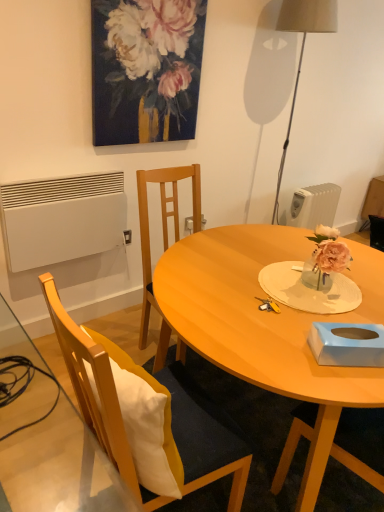
Question: Does wooden chair at left have a smaller size compared to blue cardboard tissue box at lower right?

Choices:
 (A) no
 (B) yes

Answer: (A)

Question: Does wooden chair at left have a larger size compared to blue cardboard tissue box at lower right?

Choices:
 (A) yes
 (B) no

Answer: (A)

Question: Could you tell me if wooden chair at left is turned towards blue cardboard tissue box at lower right?

Choices:
 (A) no
 (B) yes

Answer: (B)

Question: Does wooden chair at left have a greater width compared to blue cardboard tissue box at lower right?

Choices:
 (A) no
 (B) yes

Answer: (B)

Question: Is wooden chair at left positioned with its back to blue cardboard tissue box at lower right?

Choices:
 (A) yes
 (B) no

Answer: (B)

Question: In the image, is wooden chair at left positioned in front of or behind blue cardboard tissue box at lower right?

Choices:
 (A) front
 (B) behind

Answer: (A)

Question: Is wooden chair at left wider or thinner than blue cardboard tissue box at lower right?

Choices:
 (A) thin
 (B) wide

Answer: (B)

Question: Is wooden chair at left situated inside blue cardboard tissue box at lower right or outside?

Choices:
 (A) outside
 (B) inside

Answer: (A)

Question: Considering the positions of wooden chair at left and blue cardboard tissue box at lower right in the image, is wooden chair at left bigger or smaller than blue cardboard tissue box at lower right?

Choices:
 (A) big
 (B) small

Answer: (A)

Question: Is point (296, 217) positioned closer to the camera than point (167, 4)?

Choices:
 (A) farther
 (B) closer

Answer: (A)

Question: From a real-world perspective, is white plastic radiator at right, marked as the 1th radiator in a back-to-front arrangement, physically located above or below oil paint canvas at upper center?

Choices:
 (A) above
 (B) below

Answer: (B)

Question: Do you think white plastic radiator at right, marked as the 1th radiator in a back-to-front arrangement, is within oil paint canvas at upper center, or outside of it?

Choices:
 (A) inside
 (B) outside

Answer: (B)

Question: Considering the positions of white plastic radiator at right, marked as the 1th radiator in a back-to-front arrangement, and oil paint canvas at upper center in the image, is white plastic radiator at right, marked as the 1th radiator in a back-to-front arrangement, taller or shorter than oil paint canvas at upper center?

Choices:
 (A) tall
 (B) short

Answer: (B)

Question: From a real-world perspective, relative to blue cardboard tissue box at lower right, is oil paint canvas at upper center vertically above or below?

Choices:
 (A) above
 (B) below

Answer: (A)

Question: Is oil paint canvas at upper center bigger or smaller than blue cardboard tissue box at lower right?

Choices:
 (A) small
 (B) big

Answer: (B)